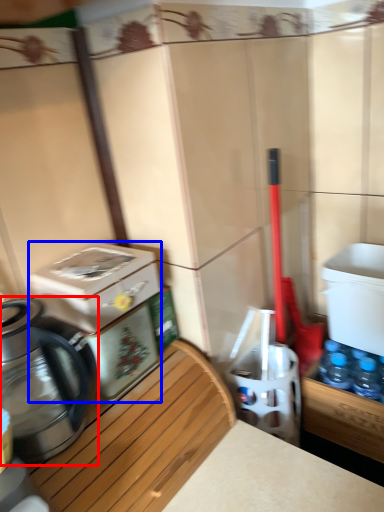
Question: Among these objects, which one is nearest to the camera, kettle (highlighted by a red box) or water cooler (highlighted by a blue box)?

Choices:
 (A) kettle
 (B) water cooler

Answer: (A)